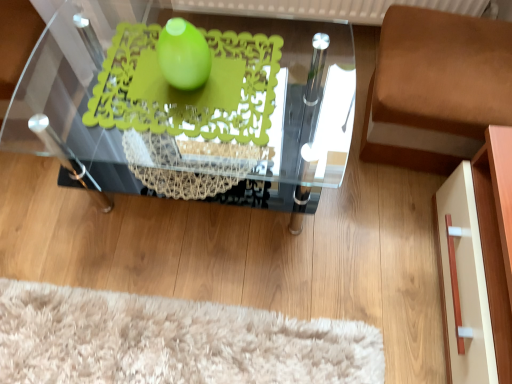
The width and height of the screenshot is (512, 384). Describe the element at coordinates (191, 106) in the screenshot. I see `transparent glass table at center` at that location.

I want to click on brown fabric cushion at right, so click(x=436, y=89).

Measure the distance from green matte doily at center to green matte sphere at center.

They are 9.76 centimeters apart.

Is green matte doily at center shorter than green matte sphere at center?

Correct, green matte doily at center is not as tall as green matte sphere at center.

Does green matte doily at center have a larger size compared to green matte sphere at center?

Yes.

Looking at their sizes, would you say green matte doily at center is wider or thinner than green matte sphere at center?

green matte doily at center is wider than green matte sphere at center.

Which is more to the right, green matte sphere at center or transparent glass table at center?

green matte sphere at center.

Is green matte sphere at center bigger than transparent glass table at center?

No.

From the image's perspective, between green matte sphere at center and transparent glass table at center, which one is located above?

green matte sphere at center.

Is green matte sphere at center shorter than transparent glass table at center?

Yes, green matte sphere at center is shorter than transparent glass table at center.

Which is more to the left, transparent glass table at center or green matte doily at center?

transparent glass table at center is more to the left.

Is transparent glass table at center aimed at green matte doily at center?

No, transparent glass table at center does not turn towards green matte doily at center.

Based on the photo, is transparent glass table at center situated inside green matte doily at center or outside?

transparent glass table at center is outside green matte doily at center.

Locate an element on the screen. This screenshot has width=512, height=384. table in front of the green matte doily at center is located at coordinates (191, 106).

Based on the photo, which of these two, green matte doily at center or brown fabric cushion at right, is bigger?

With larger size is brown fabric cushion at right.

Which of these two, green matte doily at center or brown fabric cushion at right, stands taller?

With more height is brown fabric cushion at right.

Is green matte doily at center to the right of brown fabric cushion at right from the viewer's perspective?

Incorrect, green matte doily at center is not on the right side of brown fabric cushion at right.

In the scene shown: Can brown fabric cushion at right be found inside green matte doily at center?

No.

Is green matte sphere at center taller than brown fabric cushion at right?

No.

Between green matte sphere at center and brown fabric cushion at right, which one has larger width?

brown fabric cushion at right.

From a real-world perspective, between green matte sphere at center and brown fabric cushion at right, who is vertically higher?

green matte sphere at center.

From the picture: Is green matte sphere at center positioned behind green matte doily at center?

That is False.

Which of these two, green matte sphere at center or green matte doily at center, is wider?

green matte doily at center.

Is green matte doily at center located within green matte sphere at center?

Definitely not — green matte doily at center is not inside green matte sphere at center.

Consider the image. Considering the sizes of brown fabric cushion at right and transparent glass table at center in the image, is brown fabric cushion at right wider or thinner than transparent glass table at center?

Clearly, brown fabric cushion at right has less width compared to transparent glass table at center.

Between brown fabric cushion at right and transparent glass table at center, which one has larger size?

With larger size is transparent glass table at center.

Is brown fabric cushion at right far away from transparent glass table at center?

No, there isn't a large distance between brown fabric cushion at right and transparent glass table at center.

From a real-world perspective, is brown fabric cushion at right under transparent glass table at center?

Yes, from a real-world perspective, brown fabric cushion at right is beneath transparent glass table at center.

Where is `design below the green matte sphere at center (from a real-world perspective)`? Image resolution: width=512 pixels, height=384 pixels. design below the green matte sphere at center (from a real-world perspective) is located at coordinates (188, 91).

I want to click on lime located above the transparent glass table at center (from the image's perspective), so click(183, 55).

Estimate the real-world distances between objects in this image. Which object is further from brown fabric cushion at right, green matte doily at center or transparent glass table at center?

green matte doily at center lies further to brown fabric cushion at right than the other object.

Based on their spatial positions, is green matte sphere at center or green matte doily at center closer to brown fabric cushion at right?

Among the two, green matte doily at center is located nearer to brown fabric cushion at right.

Looking at this image, based on their spatial positions, is brown fabric cushion at right or green matte doily at center closer to green matte sphere at center?

green matte doily at center lies closer to green matte sphere at center than the other object.

Looking at the image, which one is located closer to transparent glass table at center, green matte doily at center or brown fabric cushion at right?

green matte doily at center lies closer to transparent glass table at center than the other object.

Considering their positions, is brown fabric cushion at right positioned closer to transparent glass table at center than green matte doily at center?

green matte doily at center.

Looking at the image, which one is located further to brown fabric cushion at right, transparent glass table at center or green matte sphere at center?

green matte sphere at center.

From the image, which object appears to be farther from green matte doily at center, transparent glass table at center or brown fabric cushion at right?

The object further to green matte doily at center is brown fabric cushion at right.

Estimate the real-world distances between objects in this image. Which object is closer to green matte doily at center, brown fabric cushion at right or green matte sphere at center?

green matte sphere at center is positioned closer to the anchor green matte doily at center.

Identify the location of design between transparent glass table at center and brown fabric cushion at right from left to right. The width and height of the screenshot is (512, 384). (188, 91).

The height and width of the screenshot is (384, 512). I want to click on design between green matte sphere at center and brown fabric cushion at right, so click(x=188, y=91).

At what (x,y) coordinates should I click in order to perform the action: click on lime between transparent glass table at center and brown fabric cushion at right in the horizontal direction. Please return your answer as a coordinate pair (x, y). This screenshot has height=384, width=512. Looking at the image, I should click on (183, 55).

You are a GUI agent. You are given a task and a screenshot of the screen. Output one action in this format:
    pyautogui.click(x=<x>, y=<y>)
    Task: Click on the design between green matte sphere at center and transparent glass table at center in the vertical direction
    
    Given the screenshot: What is the action you would take?
    pyautogui.click(x=188, y=91)